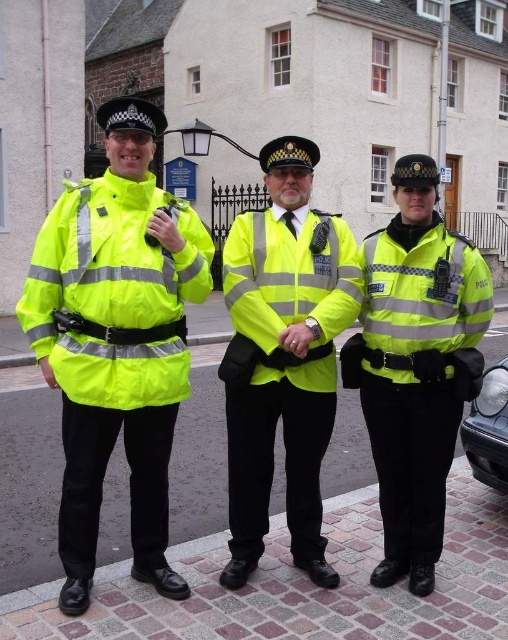
Is point (43, 288) positioned behind point (458, 330)?

No.

Can you confirm if neon yellow reflective jacket at left is shorter than high visibility yellow fabric jacket at center?

Incorrect, neon yellow reflective jacket at left's height does not fall short of high visibility yellow fabric jacket at center's.

You are a GUI agent. You are given a task and a screenshot of the screen. Output one action in this format:
    pyautogui.click(x=<x>, y=<y>)
    Task: Click on the neon yellow reflective jacket at left
    The image size is (508, 640).
    Given the screenshot: What is the action you would take?
    pyautogui.click(x=114, y=348)

Locate an element on the screen. The width and height of the screenshot is (508, 640). neon yellow reflective jacket at left is located at coordinates (114, 348).

Is the position of neon yellow reflective jacket at left more distant than that of neon yellow reflective jacket at center?

No.

How far apart are neon yellow reflective jacket at left and neon yellow reflective jacket at center?

They are 56.10 centimeters apart.

Measure the distance between point (117,307) and camera.

The distance of point (117,307) from camera is 11.71 feet.

At what (x,y) coordinates should I click in order to perform the action: click on neon yellow reflective jacket at left. Please return your answer as a coordinate pair (x, y). Looking at the image, I should click on (114, 348).

Who is higher up, neon yellow reflective jacket at center or high visibility yellow fabric jacket at center?

Positioned higher is neon yellow reflective jacket at center.

Does neon yellow reflective jacket at center appear over high visibility yellow fabric jacket at center?

Yes.

This screenshot has height=640, width=508. In order to click on neon yellow reflective jacket at center in this screenshot , I will do `click(281, 368)`.

Where is `neon yellow reflective jacket at center`? neon yellow reflective jacket at center is located at coordinates coord(281,368).